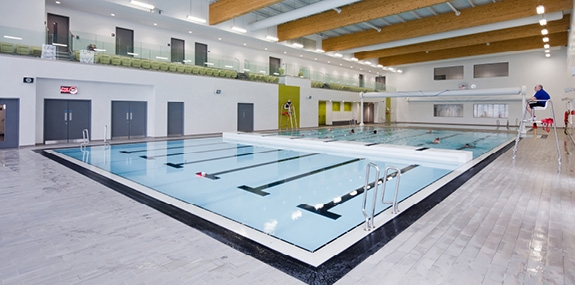
This screenshot has width=575, height=285. I want to click on tile floor, so click(x=519, y=214), click(x=51, y=223).